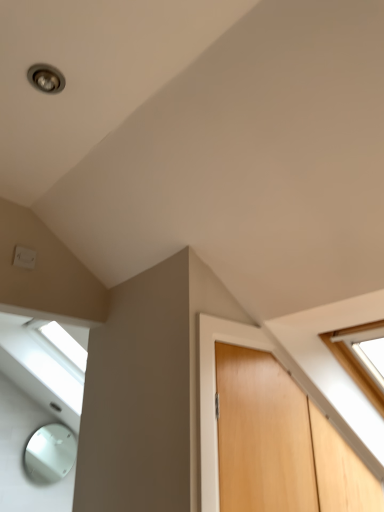
Question: From the image's perspective, relative to light brown wood door at center, is white plastic electric outlet at upper left above or below?

Choices:
 (A) below
 (B) above

Answer: (B)

Question: Is white plastic electric outlet at upper left in front of or behind light brown wood door at center in the image?

Choices:
 (A) front
 (B) behind

Answer: (B)

Question: In the image, is white plastic electric outlet at upper left on the left side or the right side of light brown wood door at center?

Choices:
 (A) left
 (B) right

Answer: (A)

Question: In the image, is light brown wood door at center positioned in front of or behind white plastic electric outlet at upper left?

Choices:
 (A) front
 (B) behind

Answer: (A)

Question: Is light brown wood door at center bigger or smaller than white plastic electric outlet at upper left?

Choices:
 (A) big
 (B) small

Answer: (A)

Question: From a real-world perspective, is light brown wood door at center positioned above or below white plastic electric outlet at upper left?

Choices:
 (A) above
 (B) below

Answer: (B)

Question: Is light brown wood door at center wider or thinner than white plastic electric outlet at upper left?

Choices:
 (A) wide
 (B) thin

Answer: (A)